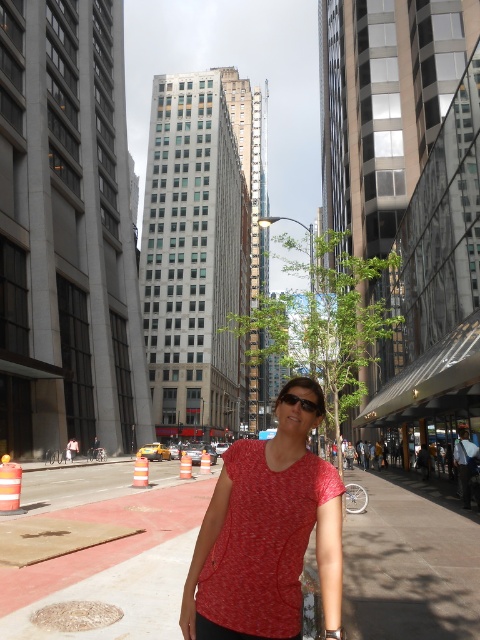
You are a photographer trying to capture a photo of the green leafy tree at center while also including the red matte shirt at center in the frame. Based on their heights, will the tree be taller than the shirt in the photo?

The red matte shirt at center is shorter than the green leafy tree at center, so yes, the tree will appear taller than the shirt in the photo.

You are a photographer trying to capture the red matte shirt at center and the green leafy tree at center in the same frame. Based on their positions, which object is located to the left of the other?

The red matte shirt at center is positioned on the left side of green leafy tree at center.

You are a delivery person carrying a box that is 1.5 meters wide. You need to walk along the path between the smooth concrete sidewalk at center and the red matte shirt at center. Is there enough space for your box to pass through?

The smooth concrete sidewalk at center is wider than the red matte shirt at center. However, the description does not provide specific measurements for either object, so it is unclear if the 1.5 meter wide box can pass through the space between them.